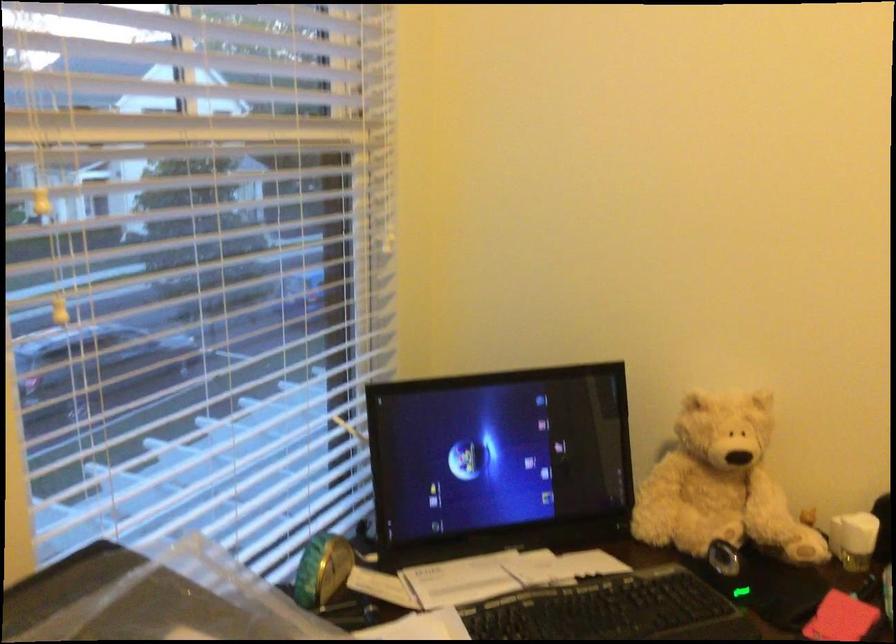
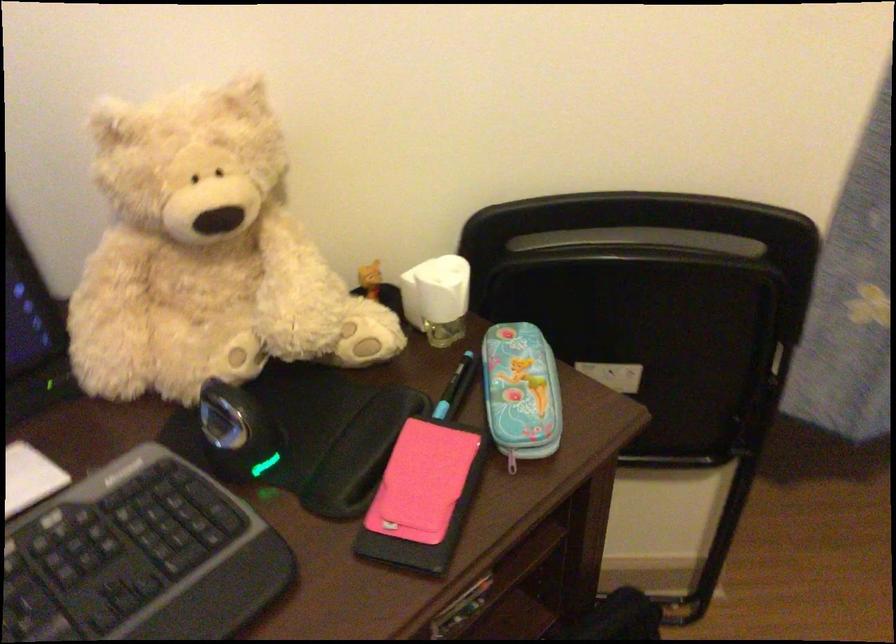
The first image is from the beginning of the video and the second image is from the end. How did the camera likely rotate when shooting the video?

The camera rotated toward right-down.